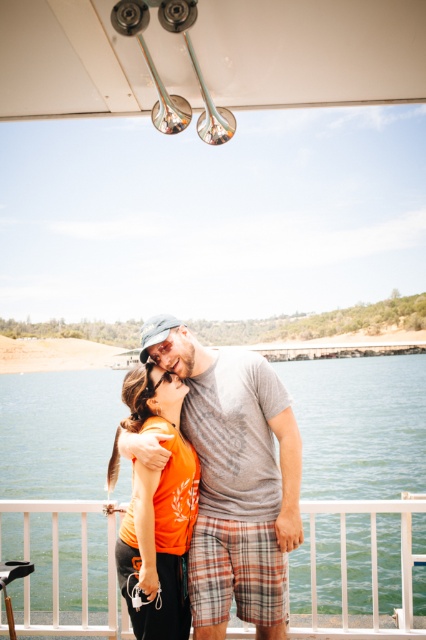
Question: Can you confirm if transparent water at center is smaller than orange matte shirt at center?

Choices:
 (A) no
 (B) yes

Answer: (A)

Question: Can you confirm if gray cotton t-shirt at center is wider than orange matte shirt at center?

Choices:
 (A) no
 (B) yes

Answer: (B)

Question: Which point is closer to the camera?

Choices:
 (A) (115, 456)
 (B) (420, 474)
 (C) (238, 529)

Answer: (C)

Question: Among these points, which one is nearest to the camera?

Choices:
 (A) (147, 588)
 (B) (279, 632)
 (C) (42, 568)

Answer: (A)

Question: Is gray cotton t-shirt at center thinner than orange matte shirt at center?

Choices:
 (A) yes
 (B) no

Answer: (B)

Question: Based on their relative distances, which object is farther from the transparent water at center?

Choices:
 (A) gray cotton t-shirt at center
 (B) orange matte shirt at center

Answer: (A)